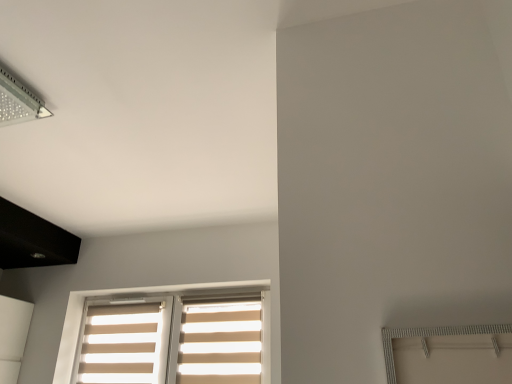
Question: Considering the positions of transparent plastic lamp at upper left and beige fabric blinds at lower center in the image, is transparent plastic lamp at upper left wider or thinner than beige fabric blinds at lower center?

Choices:
 (A) thin
 (B) wide

Answer: (B)

Question: From their relative heights in the image, would you say transparent plastic lamp at upper left is taller or shorter than beige fabric blinds at lower center?

Choices:
 (A) tall
 (B) short

Answer: (B)

Question: Which object is positioned farthest from the beige fabric curtain at lower center, which is the second curtain in left-to-right order?

Choices:
 (A) beige fabric curtain at lower left, marked as the 2th curtain in a right-to-left arrangement
 (B) beige fabric blinds at lower center
 (C) transparent plastic lamp at upper left

Answer: (C)

Question: Which object is positioned closest to the beige fabric curtain at lower center, placed as the first curtain when sorted from right to left?

Choices:
 (A) transparent plastic lamp at upper left
 (B) beige fabric curtain at lower left, marked as the 2th curtain in a right-to-left arrangement
 (C) beige fabric blinds at lower center

Answer: (C)